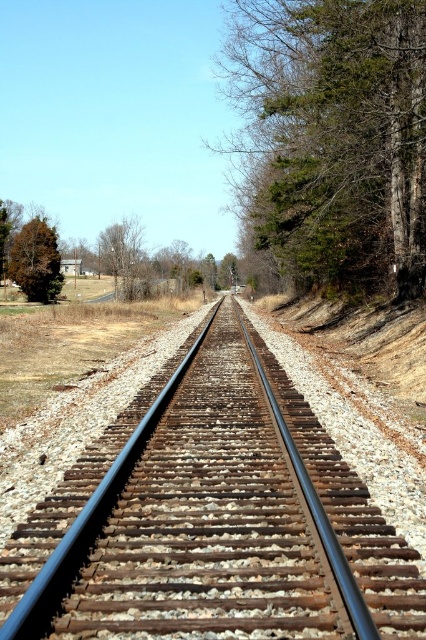
You are standing at the point marked as point (x=333, y=138). Which direction should you walk to reach the green leafy tree at right?

The green leafy tree at right is located at point (x=333, y=138), so you are already at the location of the green leafy tree at right.

You are a railway worker inspecting the tracks and notice two trees near the railway. The green leafy tree at right and the green matte tree at left. Which tree is bigger in size?

The green leafy tree at right is larger in size compared to the green matte tree at left.

You are standing on the railway platform observing the rusty metal train track at center and the green matte tree at left. Which object is closer to the ground?

The rusty metal train track at center is located below the green matte tree at left, so it is closer to the ground.